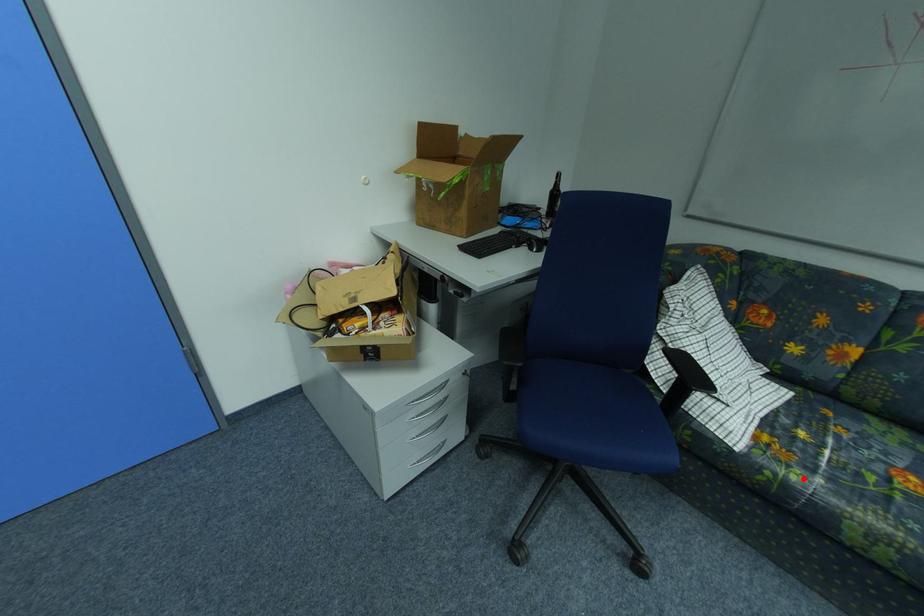
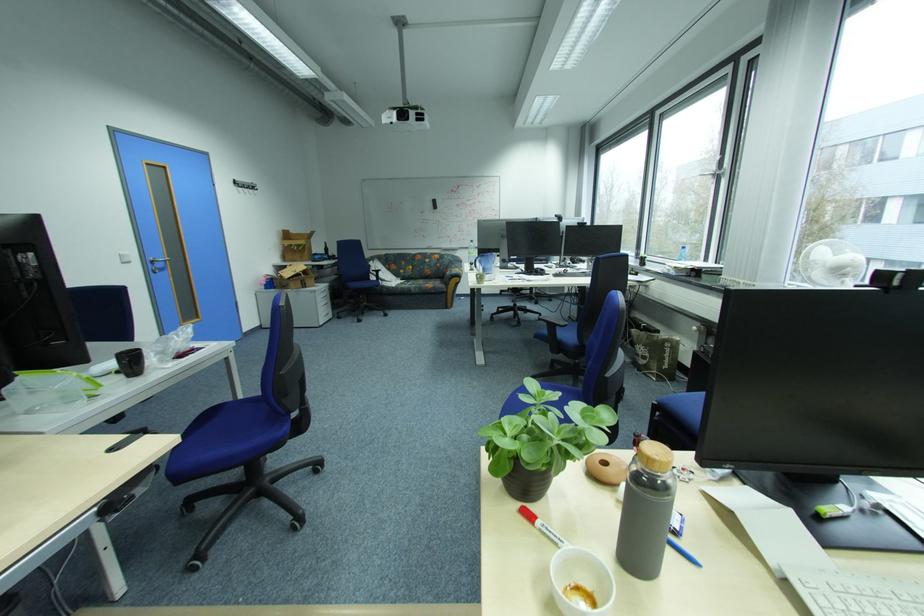
Question: I am providing you with two images of the same scene from different viewpoints. A red point is marked on the first image. Can you still see the location of the red point in image 2?

Choices:
 (A) Yes
 (B) No

Answer: (A)